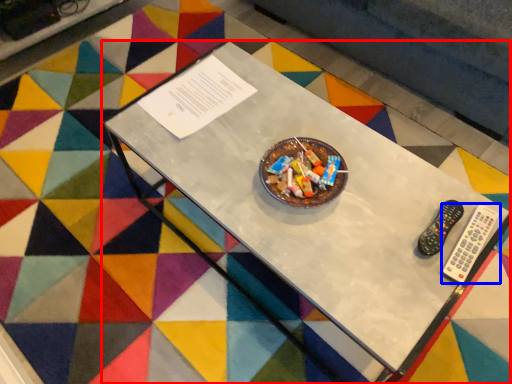
Question: Among these objects, which one is farthest to the camera, table (highlighted by a red box) or remote control (highlighted by a blue box)?

Choices:
 (A) table
 (B) remote control

Answer: (B)